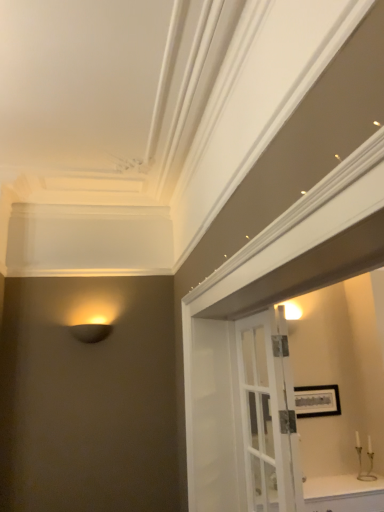
Question: From a real-world perspective, relative to white glass door at center, is white glossy cabinet at lower right vertically above or below?

Choices:
 (A) above
 (B) below

Answer: (B)

Question: Does point (347, 475) appear closer or farther from the camera than point (269, 420)?

Choices:
 (A) farther
 (B) closer

Answer: (A)

Question: Which is farther from the metallic gold candle holder at lower right?

Choices:
 (A) white glossy cabinet at lower right
 (B) white glass door at center
 (C) matte black lamp at left

Answer: (C)

Question: Considering the real-world distances, which object is farthest from the metallic gold candle holder at lower right?

Choices:
 (A) matte black lamp at left
 (B) white glossy cabinet at lower right
 (C) white glass door at center

Answer: (A)